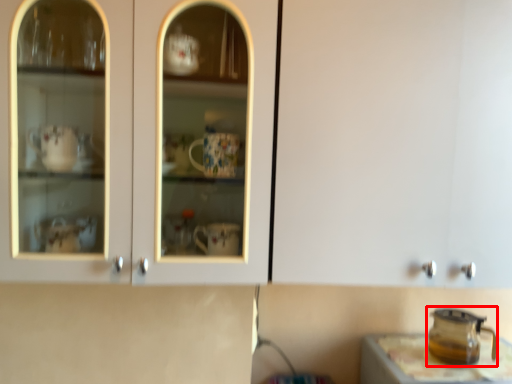
Question: Considering the relative positions of appliance (annotated by the red box) and table in the image provided, where is appliance (annotated by the red box) located with respect to the staircase?

Choices:
 (A) right
 (B) left

Answer: (B)